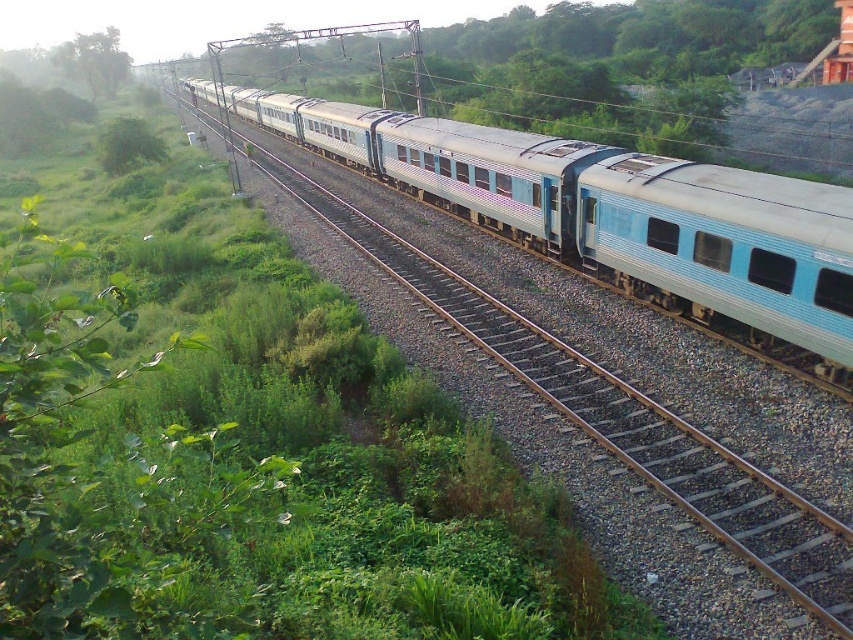
You are a photographer standing at the railway station. You want to capture a photo of the light blue metal train at center and the green leafy tree at upper left in the same frame. Based on their sizes, which one would appear bigger in the photo?

The light blue metal train at center would appear bigger in the photo because its width is larger than the green leafy tree at upper left.

You are standing at the point marked as point (x=612, y=214) in the image. What object is directly in front of you?

The point (x=612, y=214) indicates light blue metal train at center, so the object directly in front is the light blue metal train at center.